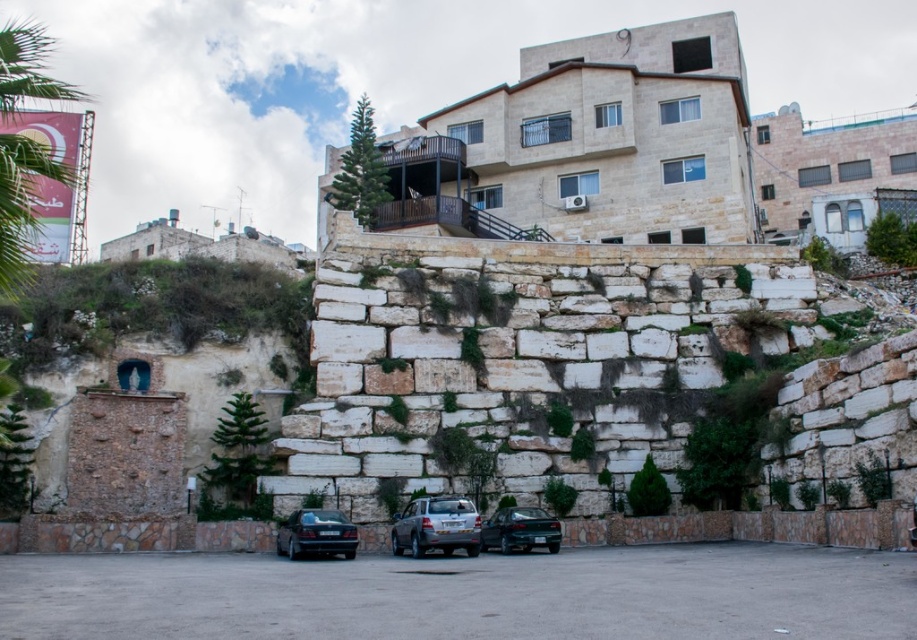
Which is behind, point (349, 227) or point (470, 538)?

The point (349, 227) is behind.

Between white stone wall at center and silver metallic car at center, which one appears on the right side from the viewer's perspective?

Positioned to the right is white stone wall at center.

Measure the distance between white stone wall at center and camera.

white stone wall at center is 44.42 meters away from camera.

You are a GUI agent. You are given a task and a screenshot of the screen. Output one action in this format:
    pyautogui.click(x=<x>, y=<y>)
    Task: Click on the white stone wall at center
    
    Given the screenshot: What is the action you would take?
    pyautogui.click(x=523, y=358)

Can you confirm if silver metallic car at center is bigger than teal glossy sedan at center?

Correct, silver metallic car at center is larger in size than teal glossy sedan at center.

Is silver metallic car at center wider than teal glossy sedan at center?

Correct, the width of silver metallic car at center exceeds that of teal glossy sedan at center.

Does point (478, 534) come farther from viewer compared to point (528, 541)?

No, it is in front of (528, 541).

Locate an element on the screen. Image resolution: width=917 pixels, height=640 pixels. silver metallic car at center is located at coordinates [436, 525].

Is white stone wall at center smaller than teal glossy sedan at center?

Actually, white stone wall at center might be larger than teal glossy sedan at center.

Which is more to the right, white stone wall at center or teal glossy sedan at center?

Positioned to the right is white stone wall at center.

Find the location of a particular element. white stone wall at center is located at coordinates (523, 358).